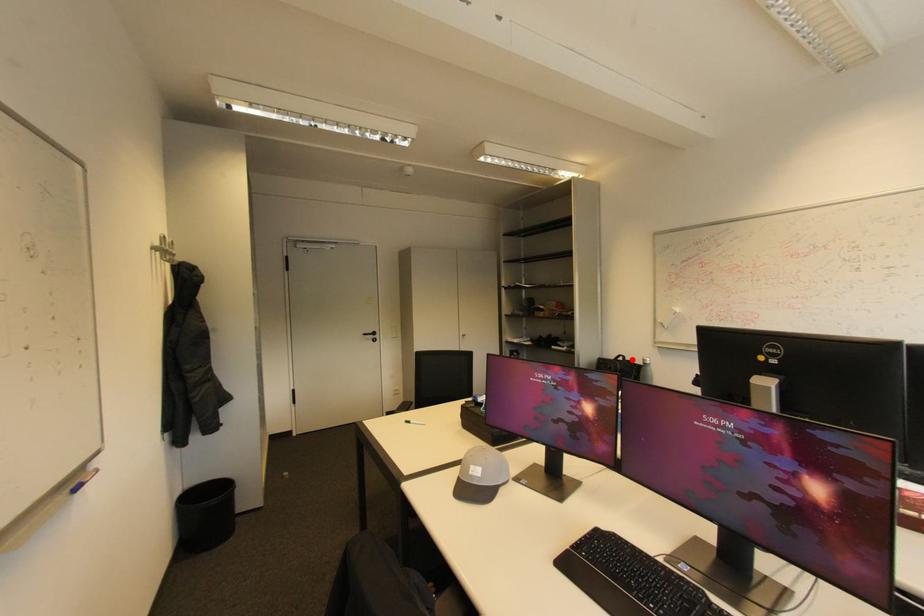
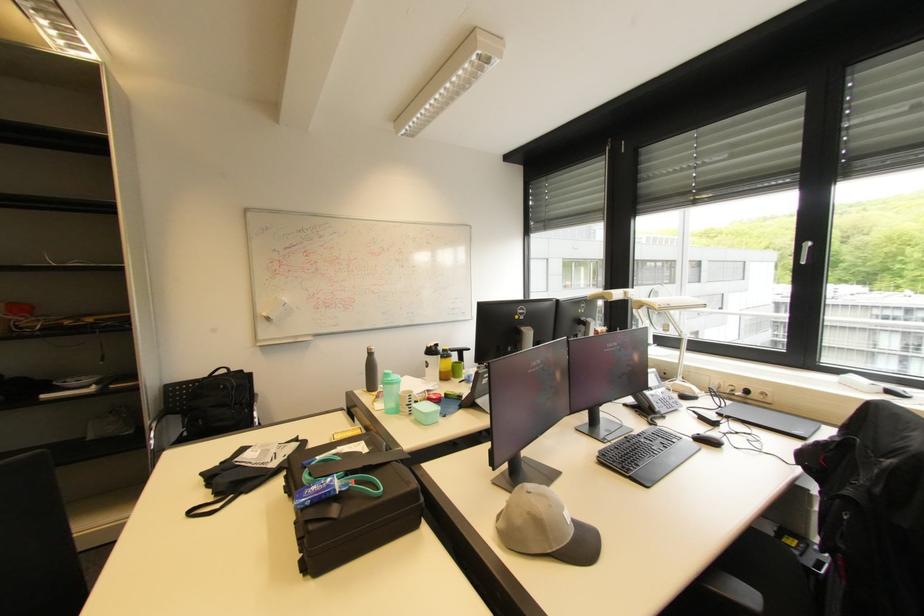
Question: I am providing you with two images of the same scene from different viewpoints. A red point is shown in image1. For the corresponding object point in image2, is it positioned nearer or farther from the camera?

Choices:
 (A) Nearer
 (B) Farther

Answer: (B)